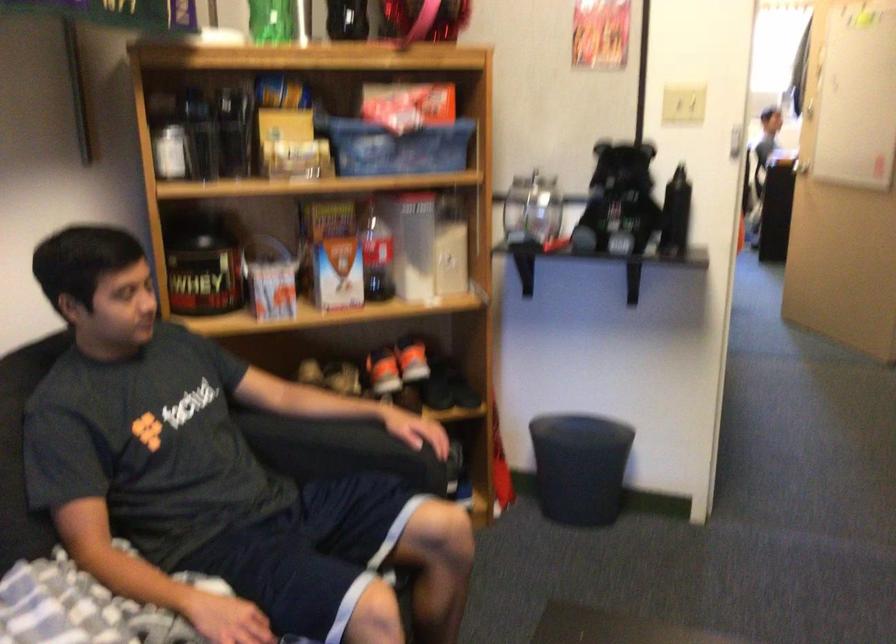
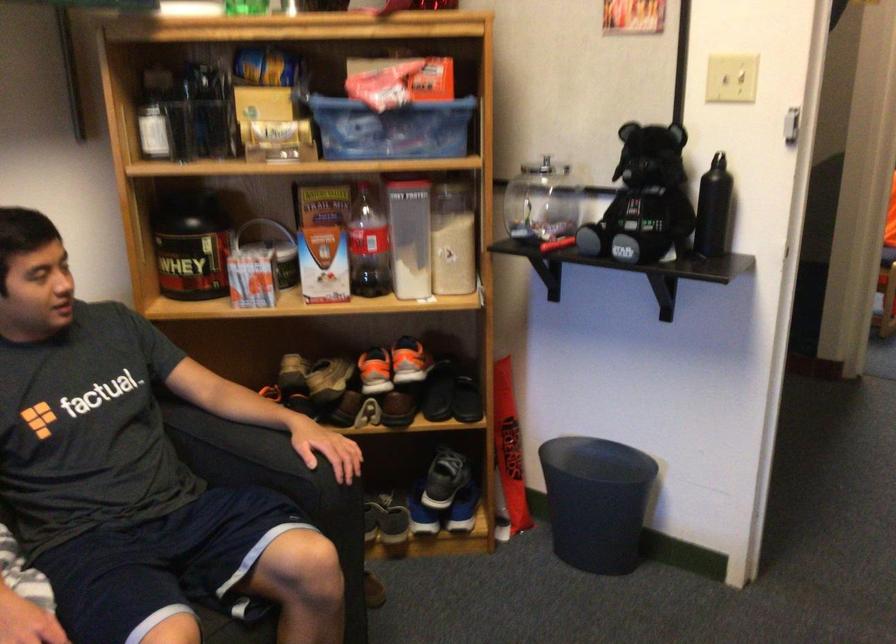
In the second image, find the point that corresponds to the point at 682,205 in the first image.

(712, 209)